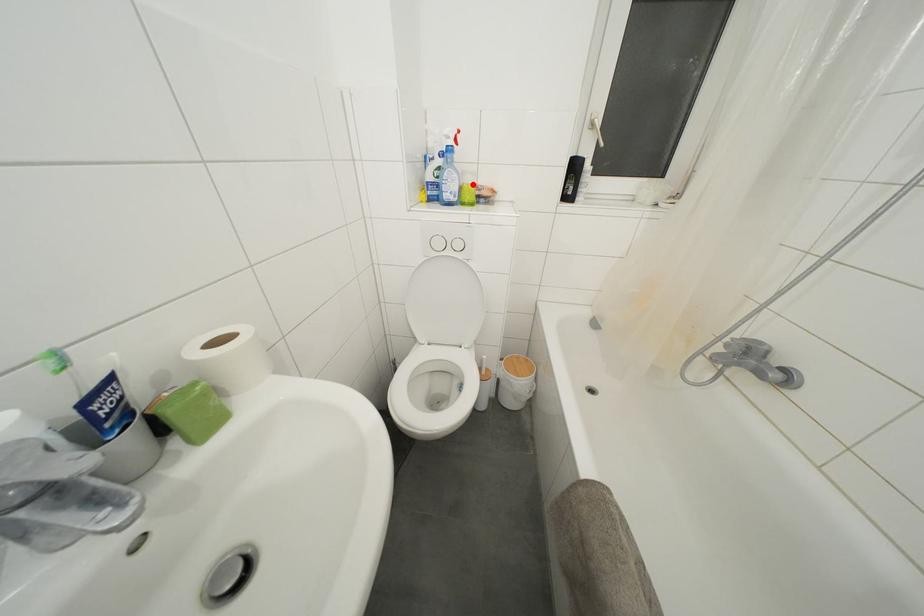
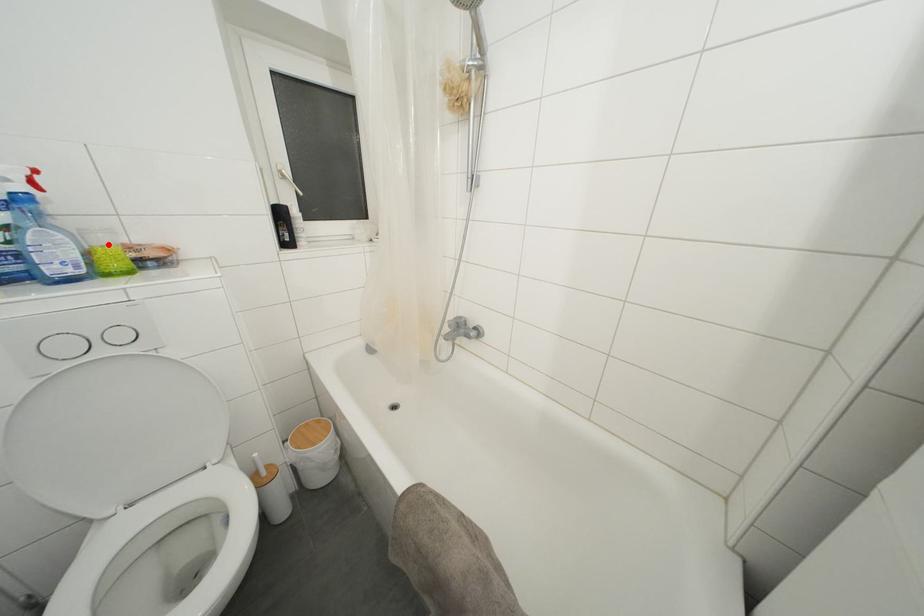
I am providing you with two images of the same scene from different viewpoints. A red point is marked on the first image and another point is marked on the second image. Is the marked point in image1 the same physical position as the marked point in image2?

Yes